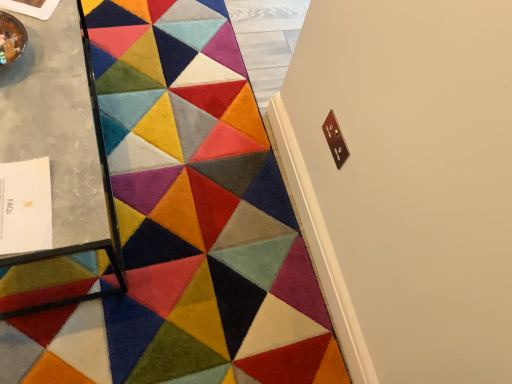
Question: Is metallic glass table at left to the left or to the right of velvety multicolored rug at center in the image?

Choices:
 (A) right
 (B) left

Answer: (B)

Question: Considering the positions of metallic glass table at left and velvety multicolored rug at center in the image, is metallic glass table at left bigger or smaller than velvety multicolored rug at center?

Choices:
 (A) big
 (B) small

Answer: (A)

Question: In the image, is metallic glass table at left positioned in front of or behind velvety multicolored rug at center?

Choices:
 (A) front
 (B) behind

Answer: (A)

Question: In terms of size, does velvety multicolored rug at center appear bigger or smaller than metallic glass table at left?

Choices:
 (A) small
 (B) big

Answer: (A)

Question: Choose the correct answer: Is velvety multicolored rug at center inside metallic glass table at left or outside it?

Choices:
 (A) inside
 (B) outside

Answer: (B)

Question: Is point (232, 89) closer or farther from the camera than point (83, 54)?

Choices:
 (A) farther
 (B) closer

Answer: (A)

Question: Considering their positions, is velvety multicolored rug at center located in front of or behind metallic glass table at left?

Choices:
 (A) front
 (B) behind

Answer: (B)